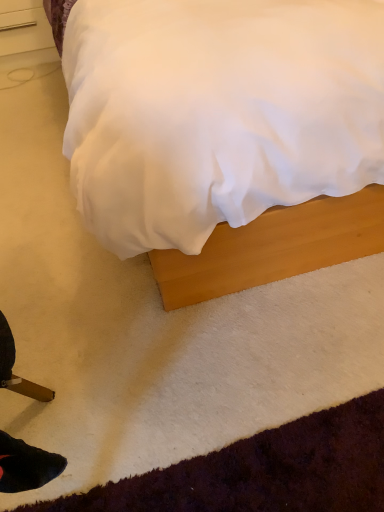
Question: Is brushed metal drawer at upper left bigger than wooden bed at center?

Choices:
 (A) no
 (B) yes

Answer: (A)

Question: From the image's perspective, is brushed metal drawer at upper left on top of wooden bed at center?

Choices:
 (A) yes
 (B) no

Answer: (A)

Question: Is brushed metal drawer at upper left looking in the opposite direction of wooden bed at center?

Choices:
 (A) yes
 (B) no

Answer: (B)

Question: Could you tell me if brushed metal drawer at upper left is turned towards wooden bed at center?

Choices:
 (A) yes
 (B) no

Answer: (B)

Question: Does brushed metal drawer at upper left have a lesser height compared to wooden bed at center?

Choices:
 (A) yes
 (B) no

Answer: (A)

Question: Does brushed metal drawer at upper left come behind wooden bed at center?

Choices:
 (A) no
 (B) yes

Answer: (B)

Question: Is wooden bed at center bigger than brushed metal drawer at upper left?

Choices:
 (A) no
 (B) yes

Answer: (B)

Question: From the image's perspective, would you say wooden bed at center is positioned over brushed metal drawer at upper left?

Choices:
 (A) yes
 (B) no

Answer: (B)

Question: Is wooden bed at center positioned beyond the bounds of brushed metal drawer at upper left?

Choices:
 (A) yes
 (B) no

Answer: (A)

Question: Does wooden bed at center have a lesser height compared to brushed metal drawer at upper left?

Choices:
 (A) no
 (B) yes

Answer: (A)

Question: Is wooden bed at center smaller than brushed metal drawer at upper left?

Choices:
 (A) yes
 (B) no

Answer: (B)

Question: Is wooden bed at center facing away from brushed metal drawer at upper left?

Choices:
 (A) yes
 (B) no

Answer: (B)

Question: Is wooden bed at center bigger or smaller than brushed metal drawer at upper left?

Choices:
 (A) big
 (B) small

Answer: (A)